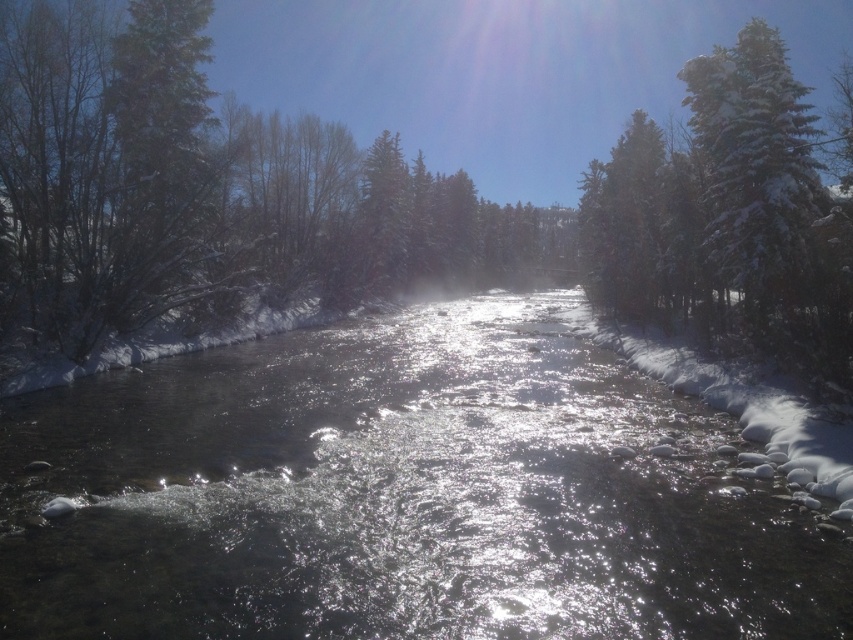
You are standing at the origin point of the image. Which direction should you move to reach the clear water at center?

The clear water at center is located at coordinates point (398, 497), so you should move towards the right and slightly upwards to reach it.

You are standing at the point with coordinates point (821, 324) and want to walk to the point with coordinates point (703, 547). Which direction should you move relative to the other point?

You should move forward towards point (703, 547) because it is in front of point (821, 324).